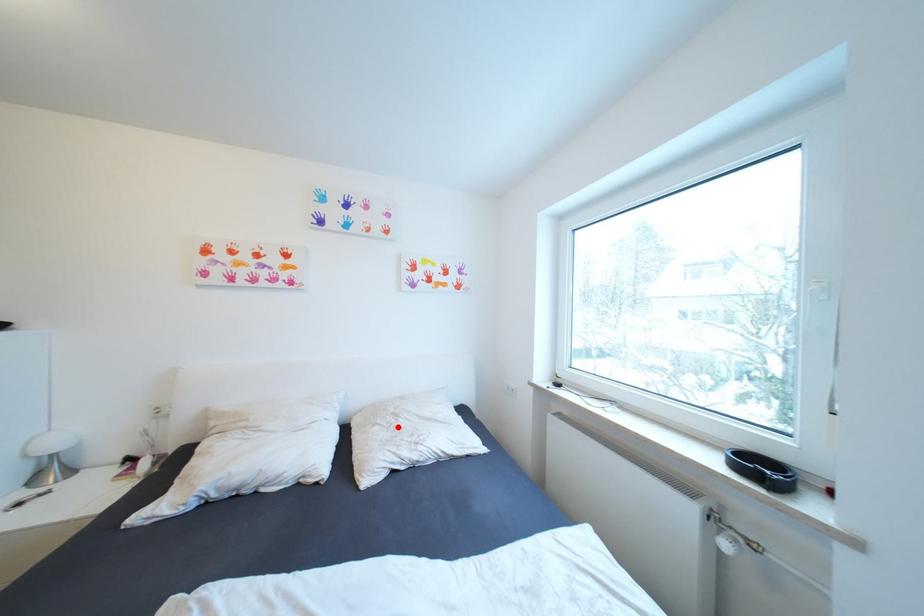
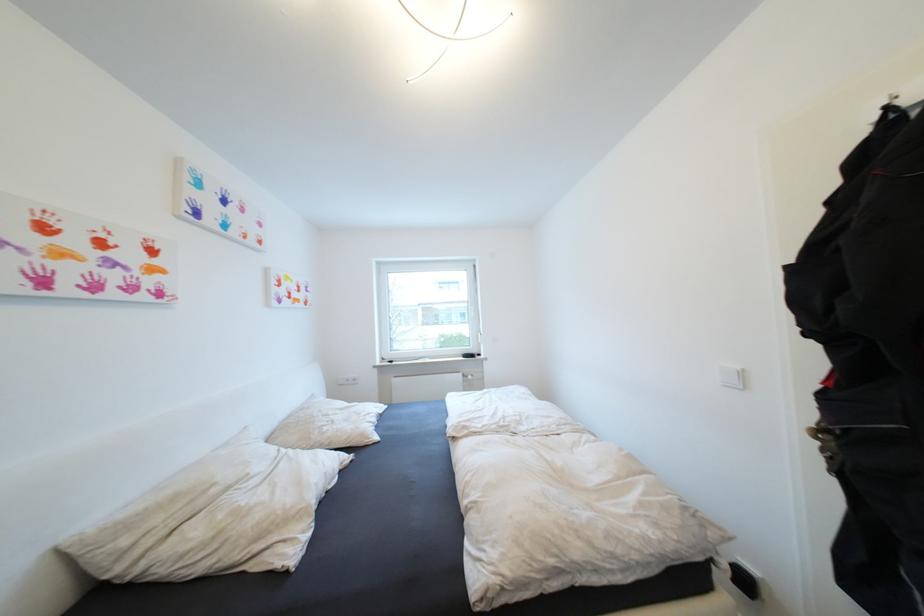
Question: I am providing you with two images of the same scene from different viewpoints. A red point is marked on the first image. Can you still see the location of the red point in image 2?

Choices:
 (A) Yes
 (B) No

Answer: (A)